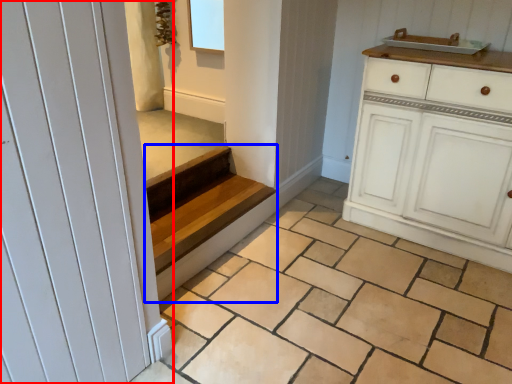
Question: Which point is closer to the camera, door (highlighted by a red box) or stairs (highlighted by a blue box)?

Choices:
 (A) door
 (B) stairs

Answer: (A)